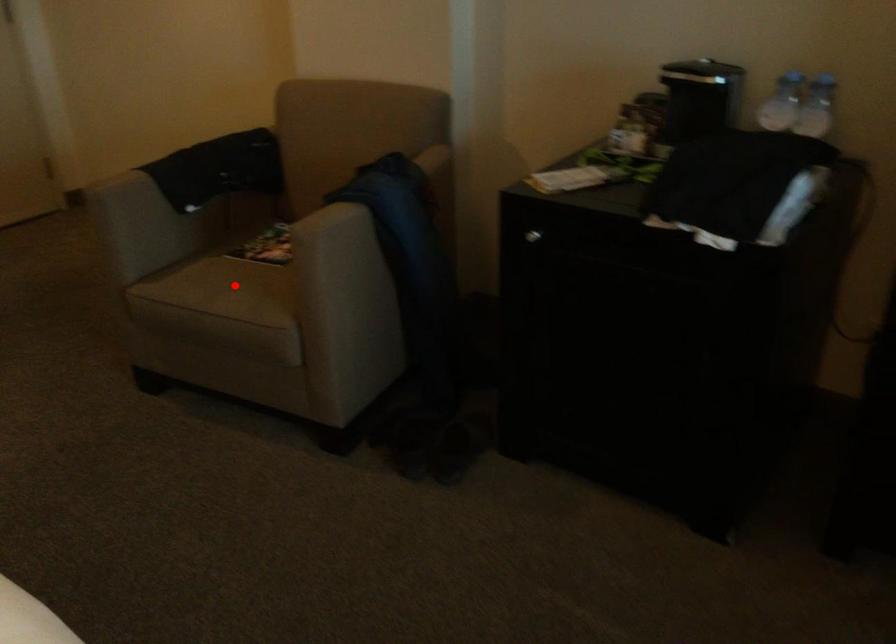
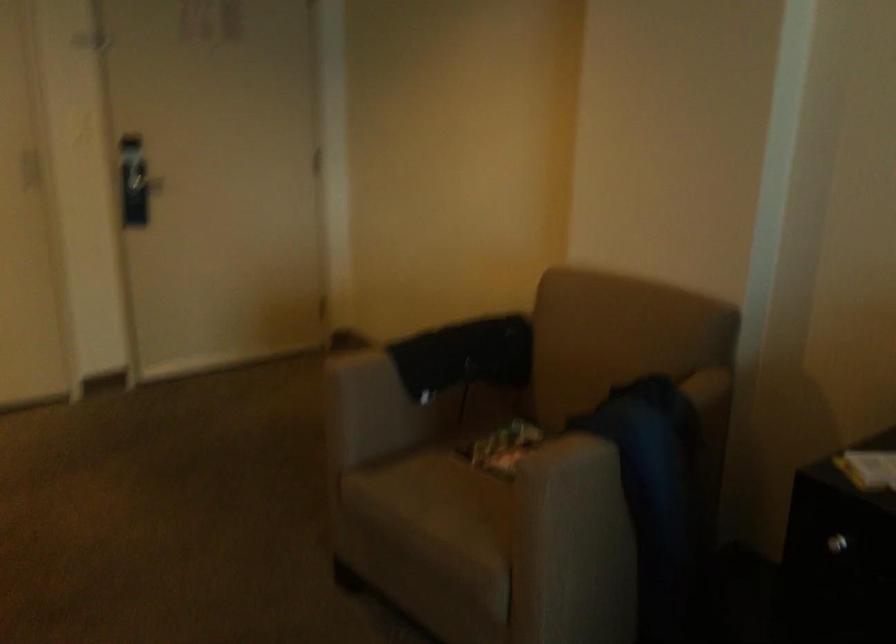
The point at the highlighted location is marked in the first image. Where is the corresponding point in the second image?

(453, 500)